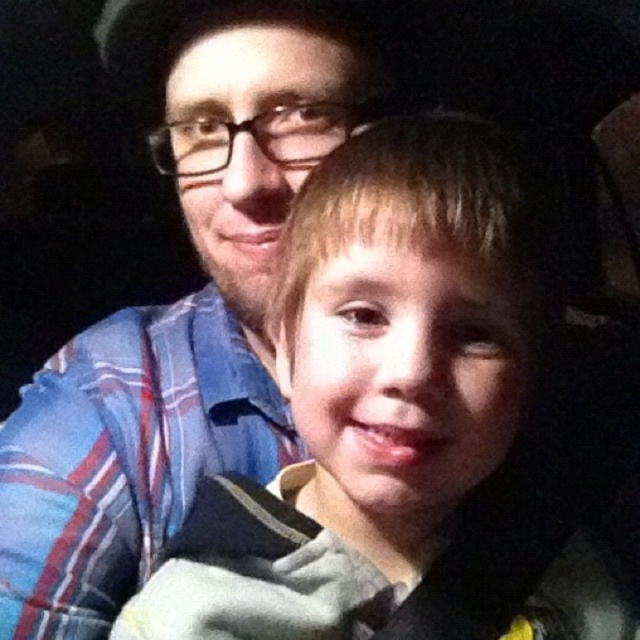
Question: Which point is closer to the camera?

Choices:
 (A) (362, 550)
 (B) (8, 508)

Answer: (A)

Question: Can you confirm if smooth tan skin at center is positioned to the right of blue plaid shirt at upper left?

Choices:
 (A) no
 (B) yes

Answer: (B)

Question: Can you confirm if smooth tan skin at center is wider than blue plaid shirt at upper left?

Choices:
 (A) yes
 (B) no

Answer: (A)

Question: Which of the following is the closest to the observer?

Choices:
 (A) smooth tan skin at center
 (B) blue plaid shirt at upper left

Answer: (A)

Question: Where is smooth tan skin at center located in relation to blue plaid shirt at upper left in the image?

Choices:
 (A) above
 (B) below

Answer: (B)